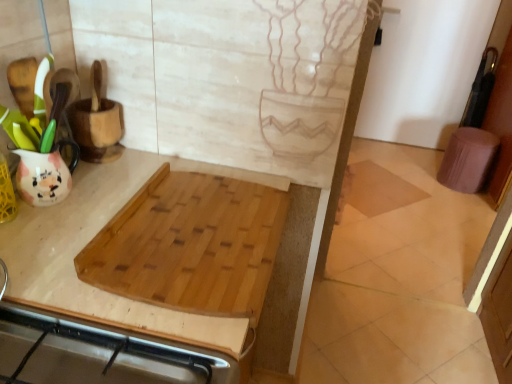
Identify the location of vacant space to the left of purple fabric step stool at right. (416, 184).